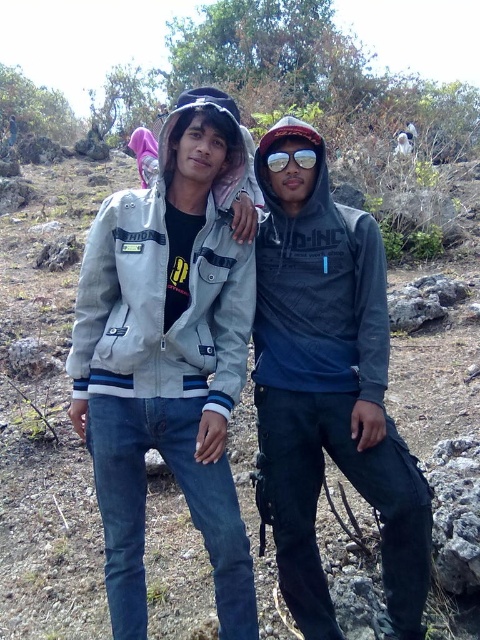
You are a photographer trying to capture both the light gray fabric jacket at center and the matte blue hoodie at center in the same frame. Based on their positions, which one should you adjust your camera angle to focus on first to ensure both are in the shot?

Since the light gray fabric jacket at center is to the left of the matte blue hoodie at center, you should focus on the matte blue hoodie at center first to ensure both are captured in the frame.

You are a photographer trying to capture a clear shot of both the light gray fabric jacket at center and the sunglasses at center. Since the sunlight is coming from the right side, which object should you position your camera to avoid glare? Explain your reasoning based on their positions.

The light gray fabric jacket at center is positioned on the left side of the sunglasses at center. To avoid glare from the sunlight coming from the right, you should position the camera to the left of the light gray fabric jacket at center so that the glare from the sunglasses at center is minimized.

You are a photographer trying to capture a clear shot of both the matte blue hoodie at center and the sunglasses at center. Since you want both items to be fully visible in the frame, which object should you adjust your camera focus to prioritize in terms of width?

The matte blue hoodie at center might be wider than sunglasses at center, so you should prioritize focusing on the matte blue hoodie at center to ensure both fit within the frame.